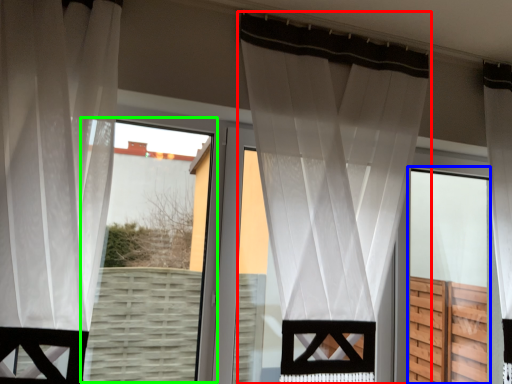
Question: Which is farther away from curtain (highlighted by a red box)? screen door (highlighted by a blue box) or bay window (highlighted by a green box)?

Choices:
 (A) screen door
 (B) bay window

Answer: (B)